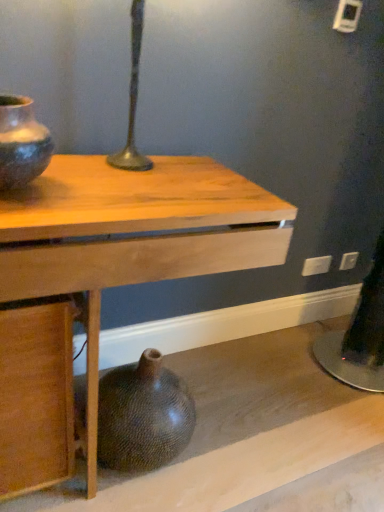
Identify the location of white plastic electric outlet at lower right, which appears as the second electric outlet when viewed from the front. (348, 261).

What is the approximate width of white plastic electric outlet at lower right, which is counted as the first electric outlet, starting from the front?

white plastic electric outlet at lower right, which is counted as the first electric outlet, starting from the front, is 2.10 centimeters in width.

Locate an element on the screen. This screenshot has height=512, width=384. brown textured vase at lower center, the first vase viewed from the back is located at coordinates (143, 416).

This screenshot has width=384, height=512. Describe the element at coordinates (131, 237) in the screenshot. I see `wooden table at center` at that location.

You are a GUI agent. You are given a task and a screenshot of the screen. Output one action in this format:
    pyautogui.click(x=<x>, y=<y>)
    Task: Click on the white plastic electric outlet at lower right, which is the first electric outlet in right-to-left order
    The width and height of the screenshot is (384, 512).
    Given the screenshot: What is the action you would take?
    pyautogui.click(x=348, y=261)

Would you say white plastic electric outlet at lower right, which is the first electric outlet in right-to-left order, is outside matte black vase at left, marked as the first vase in a front-to-back arrangement?

Yes.

Could you tell me if white plastic electric outlet at lower right, which appears as the second electric outlet when viewed from the front, is turned towards matte black vase at left, marked as the second vase in a back-to-front arrangement?

No, white plastic electric outlet at lower right, which appears as the second electric outlet when viewed from the front, is not facing towards matte black vase at left, marked as the second vase in a back-to-front arrangement.

Between white plastic electric outlet at lower right, the 1th electric outlet positioned from the back, and matte black vase at left, which is counted as the 2th vase, starting from the bottom, which one has more height?

matte black vase at left, which is counted as the 2th vase, starting from the bottom, is taller.

Considering the relative positions of white plastic electric outlet at lower right, which appears as the 2th electric outlet when viewed from the left, and matte black vase at left, positioned as the first vase in top-to-bottom order, in the image provided, is white plastic electric outlet at lower right, which appears as the 2th electric outlet when viewed from the left, behind matte black vase at left, positioned as the first vase in top-to-bottom order,?

Yes, the depth of white plastic electric outlet at lower right, which appears as the 2th electric outlet when viewed from the left, is greater than that of matte black vase at left, positioned as the first vase in top-to-bottom order.

Between white plastic electric outlet at lower right, which appears as the 2th electric outlet when viewed from the left, and white plastic electric outlet at lower right, which ranks as the first electric outlet in left-to-right order, which one has larger width?

With larger width is white plastic electric outlet at lower right, which appears as the 2th electric outlet when viewed from the left.

In the scene shown: From a real-world perspective, is white plastic electric outlet at lower right, which appears as the second electric outlet when viewed from the front, on top of white plastic electric outlet at lower right, which ranks as the first electric outlet in left-to-right order?

Yes, from a real-world perspective, white plastic electric outlet at lower right, which appears as the second electric outlet when viewed from the front, is on top of white plastic electric outlet at lower right, which ranks as the first electric outlet in left-to-right order.

Where is `electric outlet beneath the white plastic electric outlet at lower right, the 1th electric outlet positioned from the back (from a real-world perspective)`? Image resolution: width=384 pixels, height=512 pixels. electric outlet beneath the white plastic electric outlet at lower right, the 1th electric outlet positioned from the back (from a real-world perspective) is located at coordinates (316, 265).

Does point (353, 261) come in front of point (311, 260)?

No, (353, 261) is further to viewer.

Between matte black vase at left, marked as the second vase in a back-to-front arrangement, and wooden table at center, which one has smaller size?

With smaller size is matte black vase at left, marked as the second vase in a back-to-front arrangement.

Measure the distance from matte black vase at left, which is counted as the 2th vase, starting from the bottom, to wooden table at center.

matte black vase at left, which is counted as the 2th vase, starting from the bottom, is 11.08 inches away from wooden table at center.

The height and width of the screenshot is (512, 384). I want to click on table in front of the matte black vase at left, which is counted as the 2th vase, starting from the bottom, so click(x=131, y=237).

Is white plastic electric outlet at lower right, which is the first electric outlet in right-to-left order, wider or thinner than brown textured vase at lower center, the 2th vase from the front?

white plastic electric outlet at lower right, which is the first electric outlet in right-to-left order, is thinner than brown textured vase at lower center, the 2th vase from the front.

Considering the points (348, 252) and (162, 381), which point is in front, point (348, 252) or point (162, 381)?

The point (162, 381) is in front.

From a real-world perspective, which object rests below the other?

brown textured vase at lower center, the first vase viewed from the back, is physically lower.

Considering the relative positions of white plastic electric outlet at lower right, which is the first electric outlet in right-to-left order, and brown textured vase at lower center, the second vase from the top, in the image provided, is white plastic electric outlet at lower right, which is the first electric outlet in right-to-left order, to the left of brown textured vase at lower center, the second vase from the top, from the viewer's perspective?

Incorrect, white plastic electric outlet at lower right, which is the first electric outlet in right-to-left order, is not on the left side of brown textured vase at lower center, the second vase from the top.

Would you say white plastic electric outlet at lower right, which ranks as the first electric outlet in left-to-right order, contains white plastic electric outlet at lower right, which is the first electric outlet in right-to-left order?

No, white plastic electric outlet at lower right, which ranks as the first electric outlet in left-to-right order, does not contain white plastic electric outlet at lower right, which is the first electric outlet in right-to-left order.

Which object is positioned more to the right, white plastic electric outlet at lower right, which ranks as the first electric outlet in left-to-right order, or white plastic electric outlet at lower right, which appears as the 2th electric outlet when viewed from the left?

white plastic electric outlet at lower right, which appears as the 2th electric outlet when viewed from the left.

Considering the positions of objects white plastic electric outlet at lower right, which is counted as the first electric outlet, starting from the front, and white plastic electric outlet at lower right, which appears as the 2th electric outlet when viewed from the left, in the image provided, who is behind, white plastic electric outlet at lower right, which is counted as the first electric outlet, starting from the front, or white plastic electric outlet at lower right, which appears as the 2th electric outlet when viewed from the left,?

white plastic electric outlet at lower right, which appears as the 2th electric outlet when viewed from the left.

Is white plastic electric outlet at lower right, which appears as the 2th electric outlet when viewed from the back, inside the boundaries of brown textured vase at lower center, the first vase viewed from the back, or outside?

white plastic electric outlet at lower right, which appears as the 2th electric outlet when viewed from the back, is not inside brown textured vase at lower center, the first vase viewed from the back, it's outside.

Based on the photo, which object is more forward, white plastic electric outlet at lower right, which ranks as the first electric outlet in left-to-right order, or brown textured vase at lower center, the 2th vase from the front?

brown textured vase at lower center, the 2th vase from the front, is more forward.

Would you consider white plastic electric outlet at lower right, which ranks as the first electric outlet in left-to-right order, to be distant from brown textured vase at lower center, the second vase from the top?

Indeed, white plastic electric outlet at lower right, which ranks as the first electric outlet in left-to-right order, is not near brown textured vase at lower center, the second vase from the top.

Is white plastic electric outlet at lower right, the 2th electric outlet in the right-to-left sequence, facing towards brown textured vase at lower center, which is the first vase from bottom to top?

No, white plastic electric outlet at lower right, the 2th electric outlet in the right-to-left sequence, does not turn towards brown textured vase at lower center, which is the first vase from bottom to top.

From the picture: Could you tell me if wooden table at center is turned towards brown textured vase at lower center, the first vase viewed from the back?

Yes, wooden table at center is facing brown textured vase at lower center, the first vase viewed from the back.

Consider the image. Could you measure the distance between wooden table at center and brown textured vase at lower center, which is the first vase from bottom to top?

wooden table at center is 14.23 inches away from brown textured vase at lower center, which is the first vase from bottom to top.

Between wooden table at center and brown textured vase at lower center, the first vase viewed from the back, which one has more height?

wooden table at center is taller.

You are a GUI agent. You are given a task and a screenshot of the screen. Output one action in this format:
    pyautogui.click(x=<x>, y=<y>)
    Task: Click on the vase located above the white plastic electric outlet at lower right, which appears as the second electric outlet when viewed from the front (from a real-world perspective)
    
    Given the screenshot: What is the action you would take?
    pyautogui.click(x=21, y=143)

Locate an element on the screen. electric outlet above the white plastic electric outlet at lower right, the 2th electric outlet in the right-to-left sequence (from the image's perspective) is located at coordinates (348, 261).

From the image, which object appears to be nearer to wooden table at center, brown textured vase at lower center, the first vase viewed from the back, or white plastic electric outlet at lower right, the 1th electric outlet positioned from the back?

brown textured vase at lower center, the first vase viewed from the back, is closer to wooden table at center.

Considering their positions, is matte black vase at left, marked as the first vase in a front-to-back arrangement, positioned further to white plastic electric outlet at lower right, which is counted as the first electric outlet, starting from the front, than wooden table at center?

Among the two, matte black vase at left, marked as the first vase in a front-to-back arrangement, is located further to white plastic electric outlet at lower right, which is counted as the first electric outlet, starting from the front.

Which object lies further to the anchor point white plastic electric outlet at lower right, which appears as the 2th electric outlet when viewed from the back, matte black vase at left, which is counted as the 2th vase, starting from the bottom, or brown textured vase at lower center, the first vase viewed from the back?

The object further to white plastic electric outlet at lower right, which appears as the 2th electric outlet when viewed from the back, is matte black vase at left, which is counted as the 2th vase, starting from the bottom.

Looking at the image, which one is located closer to wooden table at center, white plastic electric outlet at lower right, which ranks as the first electric outlet in left-to-right order, or white plastic electric outlet at lower right, the 1th electric outlet positioned from the back?

Based on the image, white plastic electric outlet at lower right, which ranks as the first electric outlet in left-to-right order, appears to be nearer to wooden table at center.

Considering their positions, is matte black vase at left, marked as the first vase in a front-to-back arrangement, positioned further to wooden table at center than white plastic electric outlet at lower right, which appears as the 2th electric outlet when viewed from the left?

white plastic electric outlet at lower right, which appears as the 2th electric outlet when viewed from the left, is positioned further to the anchor wooden table at center.

When comparing their distances from white plastic electric outlet at lower right, which appears as the 2th electric outlet when viewed from the back, does brown textured vase at lower center, the second vase from the top, or wooden table at center seem further?

wooden table at center.

Based on their spatial positions, is wooden table at center or white plastic electric outlet at lower right, which ranks as the first electric outlet in left-to-right order, further from matte black vase at left, which is counted as the 2th vase, starting from the bottom?

white plastic electric outlet at lower right, which ranks as the first electric outlet in left-to-right order, lies further to matte black vase at left, which is counted as the 2th vase, starting from the bottom, than the other object.

Considering their positions, is white plastic electric outlet at lower right, which ranks as the first electric outlet in left-to-right order, positioned closer to white plastic electric outlet at lower right, which appears as the 2th electric outlet when viewed from the left, than wooden table at center?

white plastic electric outlet at lower right, which ranks as the first electric outlet in left-to-right order, is positioned closer to the anchor white plastic electric outlet at lower right, which appears as the 2th electric outlet when viewed from the left.

I want to click on table between matte black vase at left, marked as the first vase in a front-to-back arrangement, and brown textured vase at lower center, the second vase from the top, in the up-down direction, so click(131, 237).

You are a GUI agent. You are given a task and a screenshot of the screen. Output one action in this format:
    pyautogui.click(x=<x>, y=<y>)
    Task: Click on the electric outlet between wooden table at center and white plastic electric outlet at lower right, which appears as the 2th electric outlet when viewed from the left, in the front-back direction
    This screenshot has height=512, width=384.
    Given the screenshot: What is the action you would take?
    pyautogui.click(x=316, y=265)

Find the location of `electric outlet between brown textured vase at lower center, the second vase from the top, and white plastic electric outlet at lower right, which is the first electric outlet in right-to-left order, from front to back`. electric outlet between brown textured vase at lower center, the second vase from the top, and white plastic electric outlet at lower right, which is the first electric outlet in right-to-left order, from front to back is located at coordinates [x=316, y=265].

In order to click on vase between matte black vase at left, which is counted as the 2th vase, starting from the bottom, and white plastic electric outlet at lower right, which appears as the 2th electric outlet when viewed from the back, from front to back in this screenshot , I will do `click(143, 416)`.